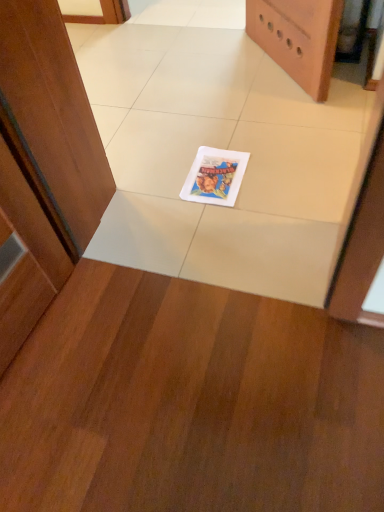
Image resolution: width=384 pixels, height=512 pixels. What are the coordinates of `free space above matte white comic book at center (from a real-world perspective)` in the screenshot? It's located at (218, 168).